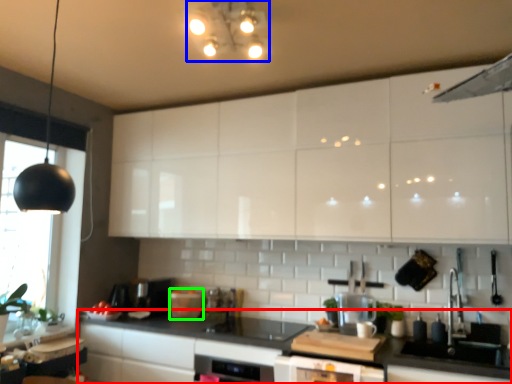
Question: Which object is the closest to the countertop (highlighted by a red box)? Choose among these: light fixture (highlighted by a blue box) or appliance (highlighted by a green box).

Choices:
 (A) light fixture
 (B) appliance

Answer: (B)